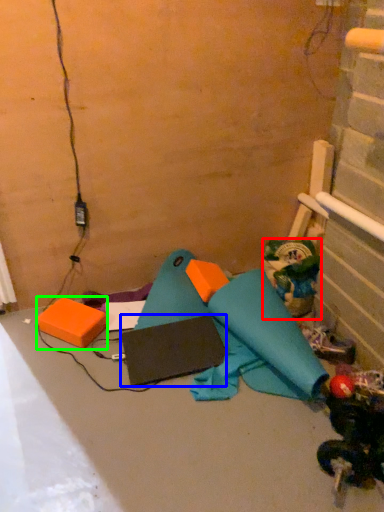
Question: Considering the real-world distances, which object is closest to toy (highlighted by a red box)? pad (highlighted by a blue box) or box (highlighted by a green box).

Choices:
 (A) pad
 (B) box

Answer: (A)